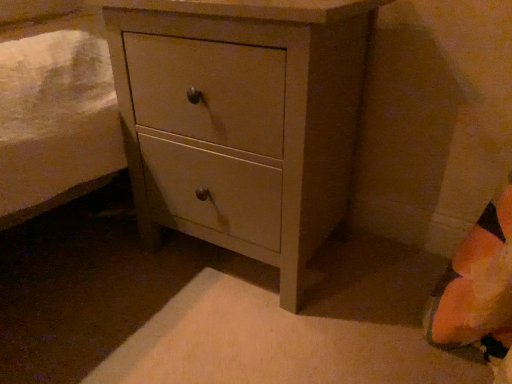
Describe the element at coordinates (241, 119) in the screenshot. I see `matte wood chest of drawers at center` at that location.

Identify the location of matte wood chest of drawers at center. This screenshot has height=384, width=512. (241, 119).

In order to click on matte wood chest of drawers at center in this screenshot , I will do [241, 119].